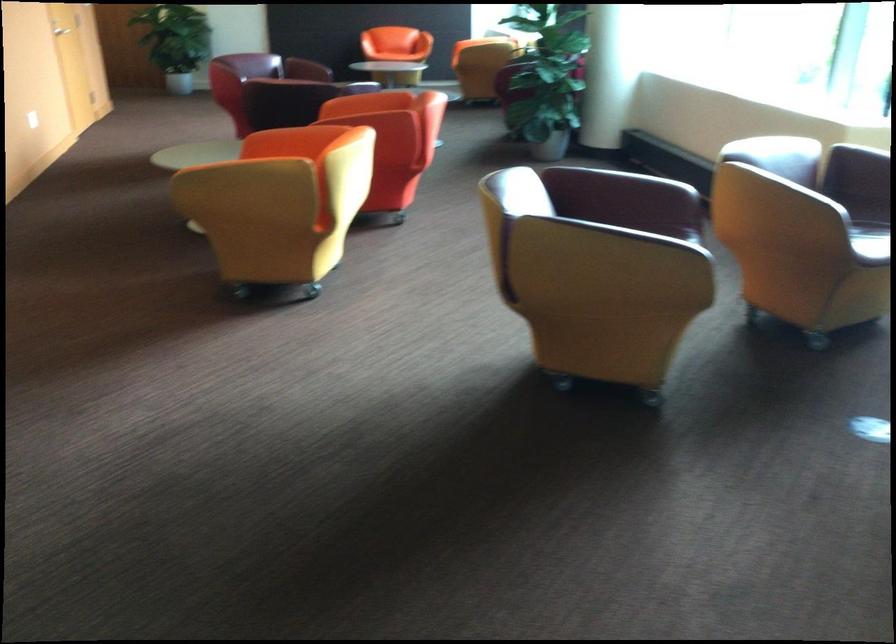
Find where to resting arm the red chair armrest. Please return your answer as a coordinate pair (x, y).

(670, 173)